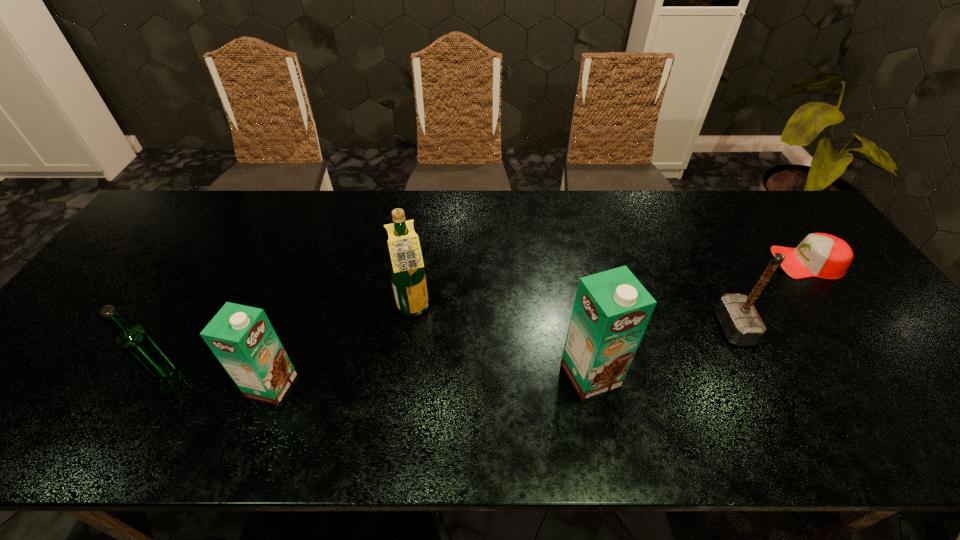
This screenshot has height=540, width=960. In order to click on vacant space located on the right of the fourth object from left to right in this screenshot , I will do `click(648, 375)`.

Find the location of a particular element. The image size is (960, 540). vacant space located on the striking surface of the fifth object from left to right is located at coordinates (629, 328).

Find the location of `vacant region located on the striking surface of the fifth object from left to right`. vacant region located on the striking surface of the fifth object from left to right is located at coordinates click(578, 328).

Identify the location of free space located on the striking surface of the fifth object from left to right. (606, 328).

The image size is (960, 540). What are the coordinates of `free space located 0.170m on the front-facing side of the liquor` in the screenshot? It's located at (495, 309).

Where is `vacant area situated 0.290m on the front-facing side of the farthest object`? vacant area situated 0.290m on the front-facing side of the farthest object is located at coordinates (674, 262).

Identify the location of vacant region located on the front-facing side of the farthest object. The image size is (960, 540). (674, 262).

You are a GUI agent. You are given a task and a screenshot of the screen. Output one action in this format:
    pyautogui.click(x=<x>, y=<y>)
    Task: Click on the free point located on the front-facing side of the farthest object
    The image size is (960, 540).
    Given the screenshot: What is the action you would take?
    point(711,262)

Locate an element on the screen. The image size is (960, 540). vacant space situated on the right of the leftmost object is located at coordinates (300, 372).

Find the location of a particular element. The width and height of the screenshot is (960, 540). beer bottle located at the near edge is located at coordinates (135, 341).